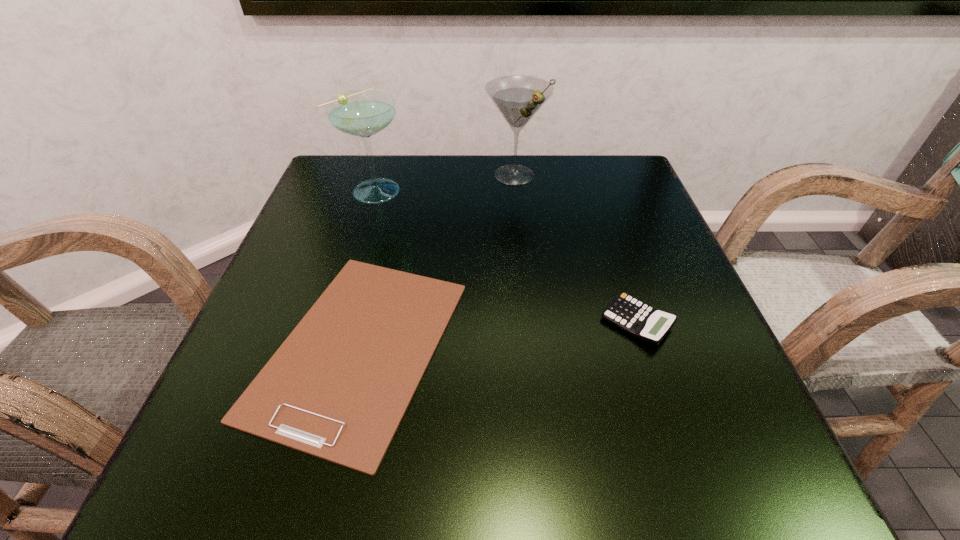
The image size is (960, 540). I want to click on the right martini, so click(x=518, y=98).

You are a GUI agent. You are given a task and a screenshot of the screen. Output one action in this format:
    pyautogui.click(x=<x>, y=<y>)
    Task: Click on the left martini
    
    Given the screenshot: What is the action you would take?
    pyautogui.click(x=363, y=113)

This screenshot has height=540, width=960. I want to click on calculator, so click(642, 321).

Identify the location of the second shortest object. This screenshot has width=960, height=540. (642, 321).

This screenshot has height=540, width=960. I want to click on clipboard, so click(x=338, y=387).

At what (x,y) coordinates should I click in order to perform the action: click on free space located on the left of the right martini. Please return your answer as a coordinate pair (x, y). Looking at the image, I should click on (364, 176).

Locate an element on the screen. This screenshot has height=540, width=960. free space located 0.180m on the right of the left martini is located at coordinates (485, 189).

This screenshot has height=540, width=960. What are the coordinates of `blank area located 0.260m on the left of the rightmost object` in the screenshot? It's located at (445, 322).

The height and width of the screenshot is (540, 960). I want to click on free space located on the right of the clipboard, so click(x=551, y=347).

You are a GUI agent. You are given a task and a screenshot of the screen. Output one action in this format:
    pyautogui.click(x=<x>, y=<y>)
    Task: Click on the object at the near edge
    Image resolution: width=960 pixels, height=540 pixels.
    Given the screenshot: What is the action you would take?
    pyautogui.click(x=338, y=387)